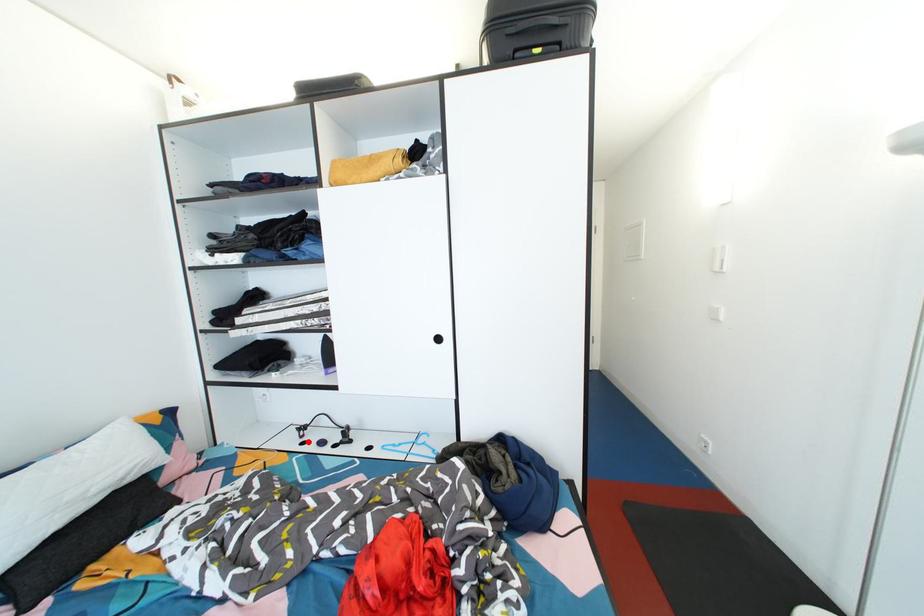
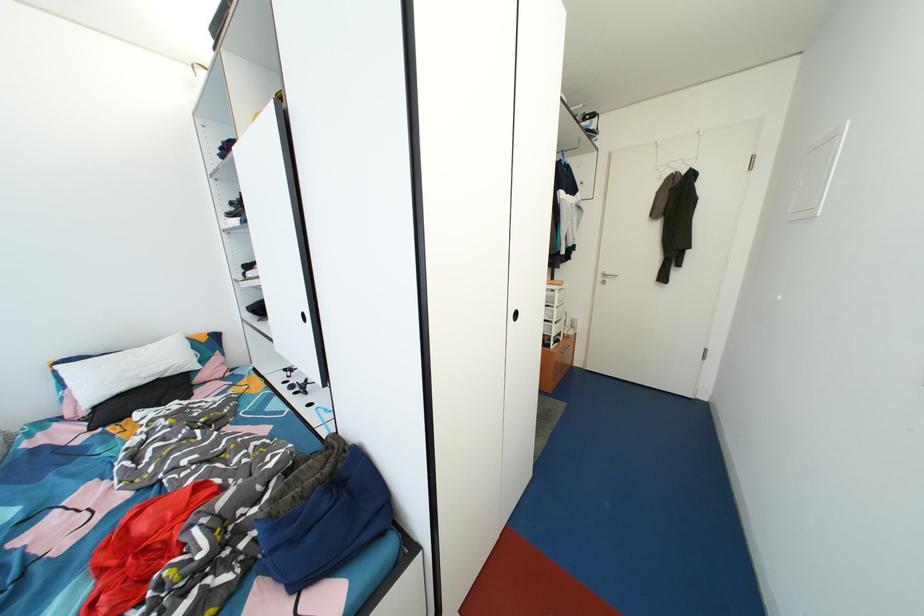
Locate, in the second image, the point that corresponds to the highlighted location in the first image.

(295, 382)